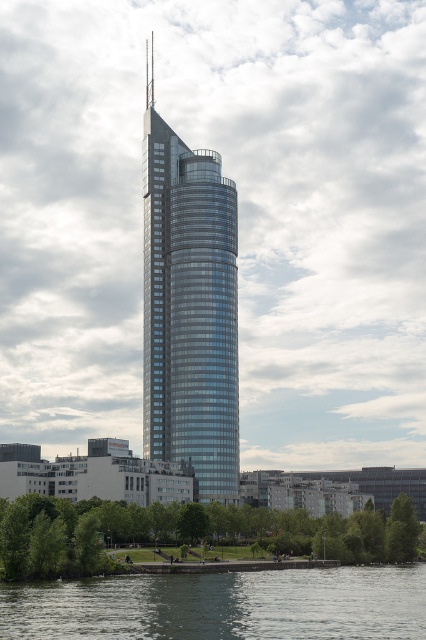
Is glassy steel tower at center to the right of green leafy tree at lower center from the viewer's perspective?

Incorrect, glassy steel tower at center is not on the right side of green leafy tree at lower center.

Find the location of a particular element. The width and height of the screenshot is (426, 640). glassy steel tower at center is located at coordinates (189, 308).

The image size is (426, 640). Find the location of `glassy steel tower at center`. glassy steel tower at center is located at coordinates (189, 308).

Does clear water at lower center have a lesser width compared to green leafy tree at lower center?

Indeed, clear water at lower center has a lesser width compared to green leafy tree at lower center.

Between point (176, 586) and point (399, 520), which one is positioned behind?

The point (399, 520) is behind.

You are a GUI agent. You are given a task and a screenshot of the screen. Output one action in this format:
    pyautogui.click(x=<x>, y=<y>)
    Task: Click on the clear water at lower center
    
    Given the screenshot: What is the action you would take?
    pyautogui.click(x=222, y=605)

Between glassy steel tower at center and clear water at lower center, which one has more height?

With more height is glassy steel tower at center.

Is point (155, 230) farther from viewer compared to point (382, 573)?

Yes, point (155, 230) is behind point (382, 573).

What do you see at coordinates (189, 308) in the screenshot?
I see `glassy steel tower at center` at bounding box center [189, 308].

Where is `glassy steel tower at center`? The height and width of the screenshot is (640, 426). glassy steel tower at center is located at coordinates (189, 308).